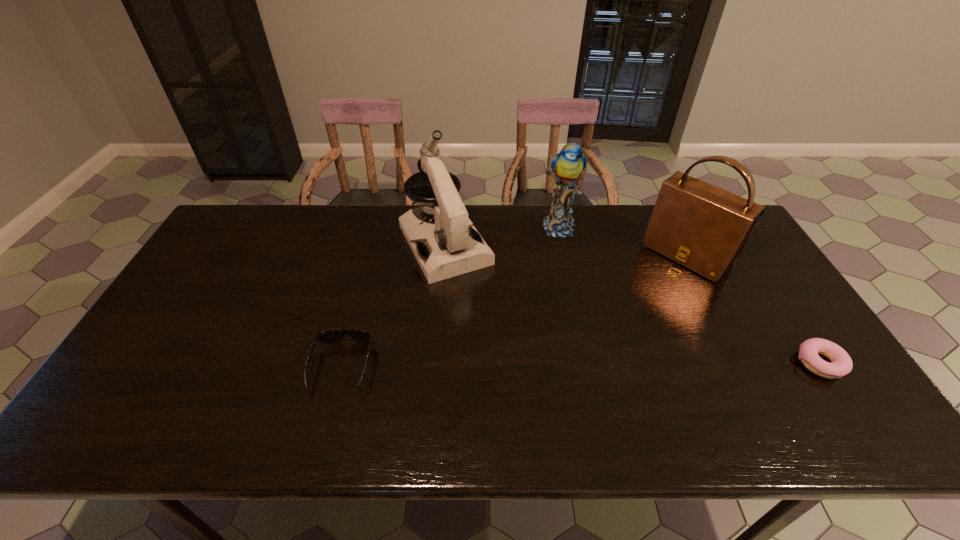
You are a GUI agent. You are given a task and a screenshot of the screen. Output one action in this format:
    pyautogui.click(x=<x>, y=<y>)
    Task: Click on the sunglasses
    The width and height of the screenshot is (960, 540).
    Given the screenshot: What is the action you would take?
    pyautogui.click(x=334, y=335)

This screenshot has width=960, height=540. I want to click on the rightmost object, so click(x=841, y=364).

In order to click on the shortest object in this screenshot , I will do `click(841, 364)`.

You are a GUI agent. You are given a task and a screenshot of the screen. Output one action in this format:
    pyautogui.click(x=<x>, y=<y>)
    Task: Click on the microscope
    This screenshot has width=960, height=540.
    Given the screenshot: What is the action you would take?
    pyautogui.click(x=451, y=246)

This screenshot has height=540, width=960. I want to click on shoulder bag, so click(703, 227).

Locate an element on the screen. The image size is (960, 540). parrot is located at coordinates (567, 165).

The height and width of the screenshot is (540, 960). Identify the location of vacant space located on the back of the shortest object. (762, 276).

You are a GUI agent. You are given a task and a screenshot of the screen. Output one action in this format:
    pyautogui.click(x=<x>, y=<y>)
    Task: Click on the free space located at the eyepiece of the microscope
    
    Given the screenshot: What is the action you would take?
    pyautogui.click(x=478, y=305)

At what (x,y) coordinates should I click in order to perform the action: click on vacant region located 0.070m at the eyepiece of the microscope. Please return your answer as a coordinate pair (x, y). This screenshot has width=960, height=540. Looking at the image, I should click on (472, 296).

Identify the location of free point located at the eyepiece of the microscope. The image size is (960, 540). (475, 301).